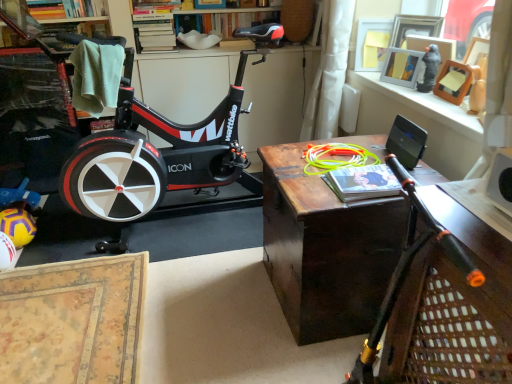
The image size is (512, 384). I want to click on blank space situated above dark wood table at center (from a real-world perspective), so click(339, 161).